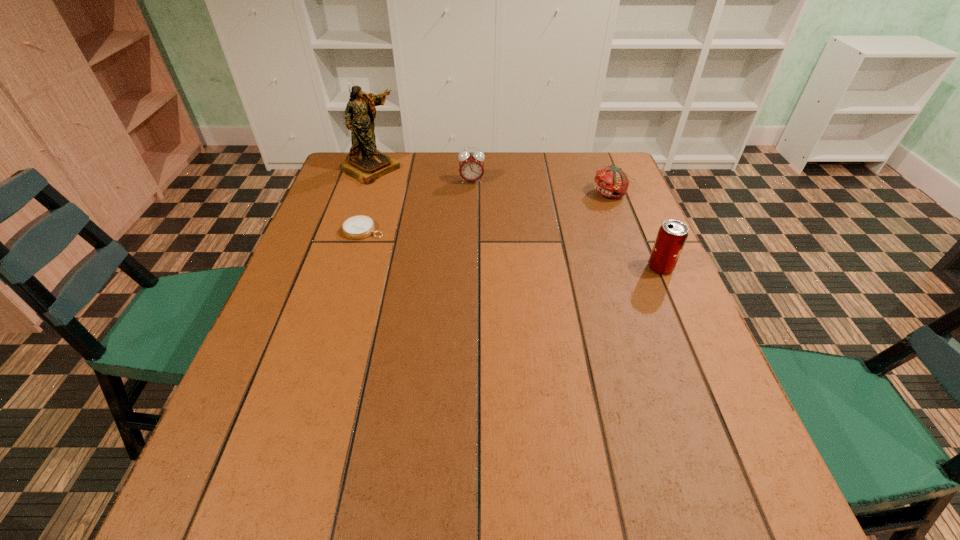
The height and width of the screenshot is (540, 960). What are the coordinates of `vacant area situated 0.060m on the clock face of the third object from right to left` in the screenshot? It's located at (471, 196).

Find the location of a particular element. The image size is (960, 540). blank space located on the front-facing side of the tomato is located at coordinates (585, 213).

Where is `vacant point located on the front-facing side of the tomato`? The width and height of the screenshot is (960, 540). vacant point located on the front-facing side of the tomato is located at coordinates (516, 267).

Find the location of `blank space located on the front-facing side of the tomato`. blank space located on the front-facing side of the tomato is located at coordinates (567, 226).

Identify the location of free space located 0.150m on the front-facing side of the tallest object. click(420, 199).

Locate an element on the screen. This screenshot has width=960, height=540. free space located on the front-facing side of the tallest object is located at coordinates (414, 195).

Locate an element on the screen. blank space located on the front-facing side of the tallest object is located at coordinates (436, 209).

Where is `alarm clock that is at the far edge`? This screenshot has width=960, height=540. alarm clock that is at the far edge is located at coordinates (471, 167).

In order to click on tomato located in the far edge section of the desktop in this screenshot , I will do `click(612, 182)`.

Locate an element on the screen. The width and height of the screenshot is (960, 540). figurine positioned at the far edge is located at coordinates (366, 164).